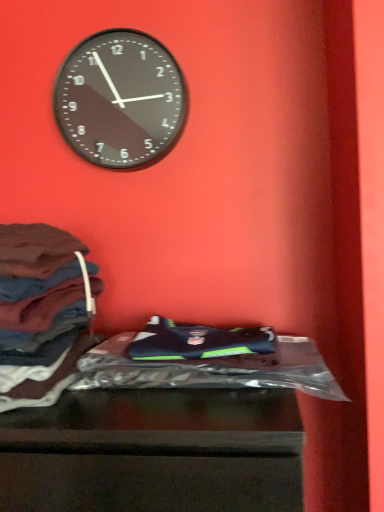
Question: Is black glass clock at upper center taller than dark brown fabric at left?

Choices:
 (A) no
 (B) yes

Answer: (B)

Question: Can you confirm if black glass clock at upper center is positioned to the right of dark brown fabric at left?

Choices:
 (A) no
 (B) yes

Answer: (B)

Question: Is black glass clock at upper center positioned behind dark brown fabric at left?

Choices:
 (A) yes
 (B) no

Answer: (A)

Question: Is black glass clock at upper center outside of dark brown fabric at left?

Choices:
 (A) yes
 (B) no

Answer: (A)

Question: From a real-world perspective, is black glass clock at upper center physically below dark brown fabric at left?

Choices:
 (A) yes
 (B) no

Answer: (B)

Question: From a real-world perspective, is black glass clock at upper center physically located above or below shiny plastic bag at center?

Choices:
 (A) below
 (B) above

Answer: (B)

Question: Considering the positions of black glass clock at upper center and shiny plastic bag at center in the image, is black glass clock at upper center wider or thinner than shiny plastic bag at center?

Choices:
 (A) wide
 (B) thin

Answer: (B)

Question: In the image, is black glass clock at upper center positioned in front of or behind shiny plastic bag at center?

Choices:
 (A) front
 (B) behind

Answer: (B)

Question: Which is correct: black glass clock at upper center is inside shiny plastic bag at center, or outside of it?

Choices:
 (A) outside
 (B) inside

Answer: (A)

Question: In terms of width, does dark brown fabric at left look wider or thinner when compared to black glass clock at upper center?

Choices:
 (A) thin
 (B) wide

Answer: (B)

Question: From the image's perspective, is dark brown fabric at left above or below black glass clock at upper center?

Choices:
 (A) below
 (B) above

Answer: (A)

Question: From a real-world perspective, relative to black glass clock at upper center, is dark brown fabric at left vertically above or below?

Choices:
 (A) above
 (B) below

Answer: (B)

Question: Based on their positions, is dark brown fabric at left located to the left or right of black glass clock at upper center?

Choices:
 (A) left
 (B) right

Answer: (A)

Question: In terms of height, does dark brown fabric at left look taller or shorter compared to shiny plastic bag at center?

Choices:
 (A) tall
 (B) short

Answer: (A)

Question: Relative to shiny plastic bag at center, is dark brown fabric at left in front or behind?

Choices:
 (A) behind
 (B) front

Answer: (B)